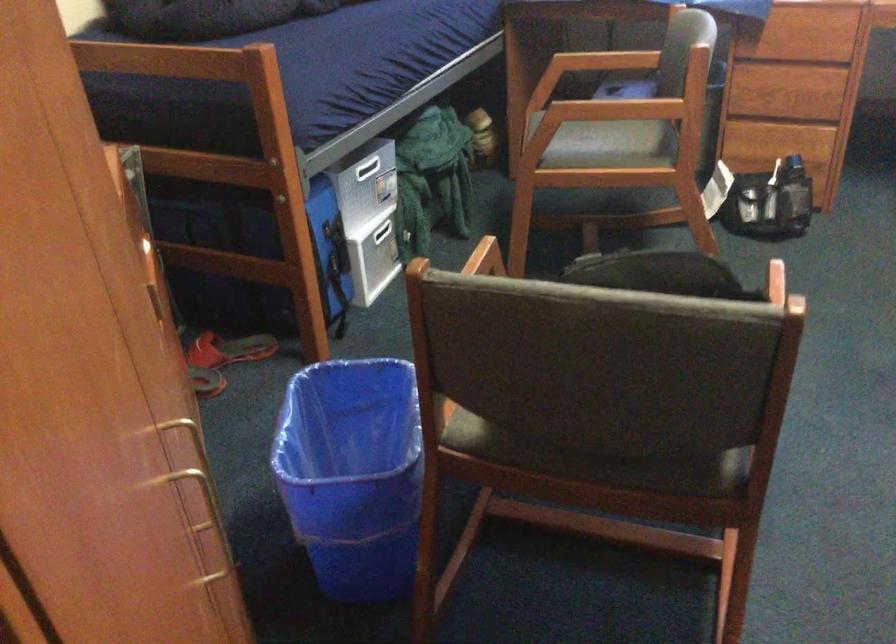
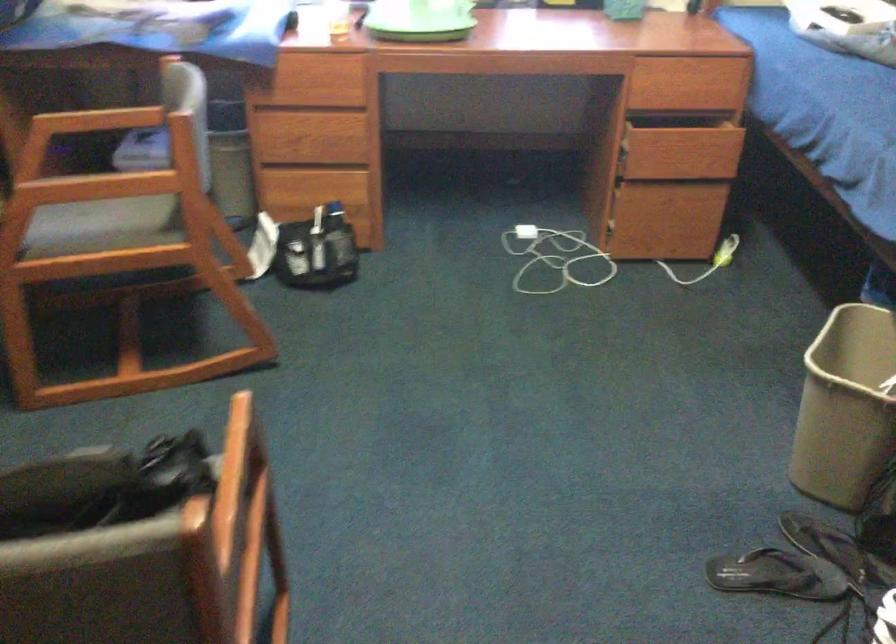
Question: The first image is from the beginning of the video and the second image is from the end. How did the camera likely rotate when shooting the video?

Choices:
 (A) Left
 (B) Right
 (C) Up
 (D) Down

Answer: (B)